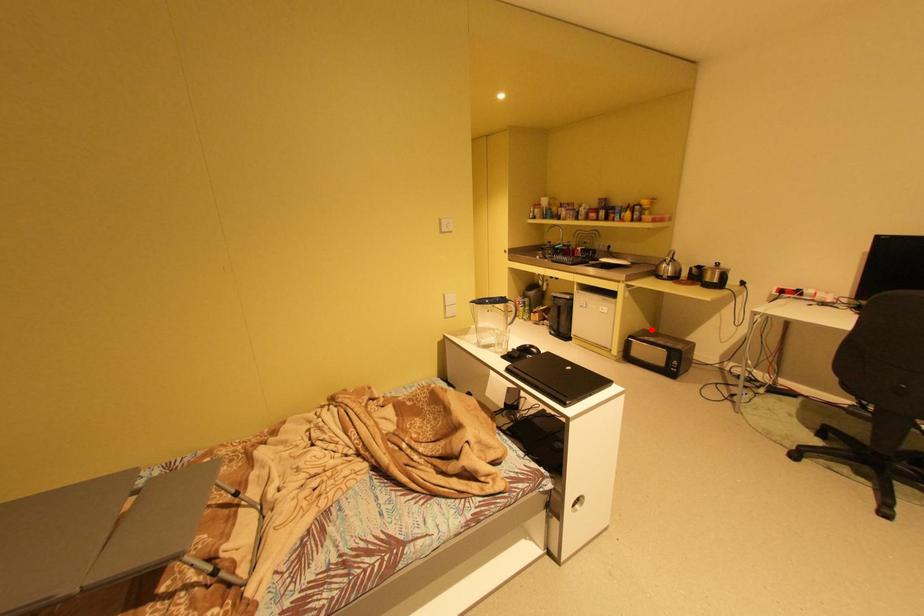
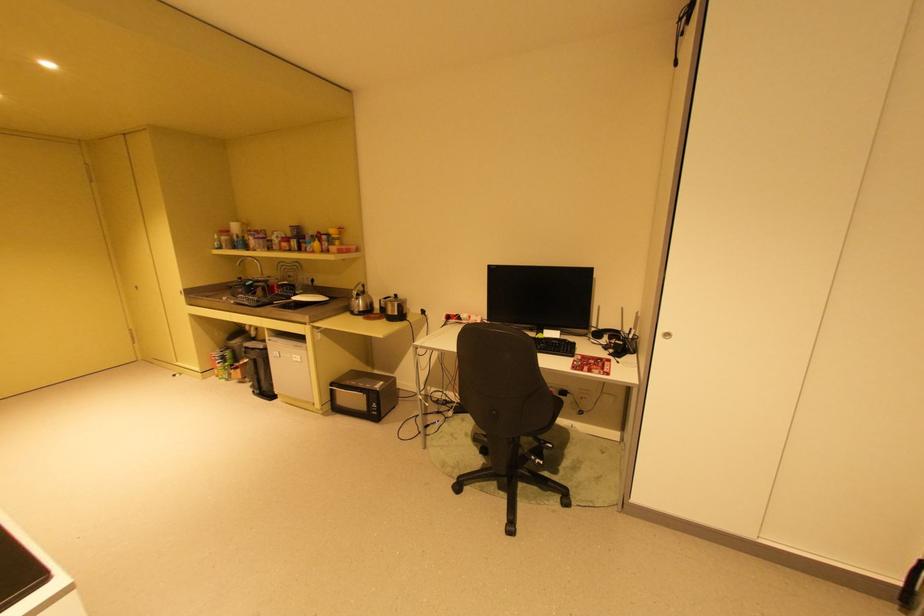
Question: I am providing you with two images of the same scene from different viewpoints. Given a red point in image1, look at the same physical point in image2. Is it:

Choices:
 (A) Closer to the viewpoint
 (B) Farther from the viewpoint

Answer: (A)